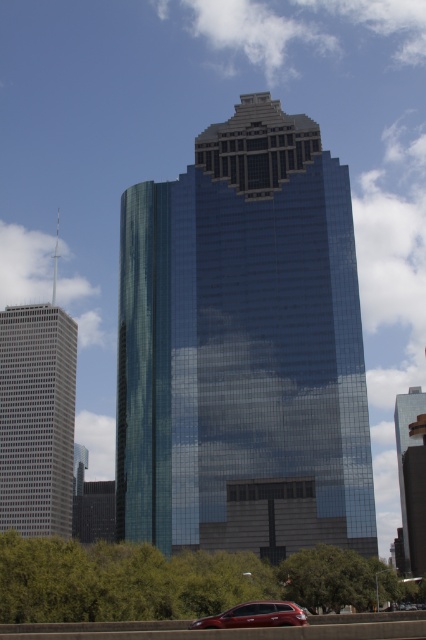
Is shiny glass skyscraper at center above shiny glass skyscraper at right?

Yes.

Which is more to the right, shiny glass skyscraper at center or shiny glass skyscraper at right?

Positioned to the right is shiny glass skyscraper at right.

What do you see at coordinates (244, 348) in the screenshot?
I see `shiny glass skyscraper at center` at bounding box center [244, 348].

You are a GUI agent. You are given a task and a screenshot of the screen. Output one action in this format:
    pyautogui.click(x=<x>, y=<y>)
    Task: Click on the shiny glass skyscraper at center
    The width and height of the screenshot is (426, 640).
    Given the screenshot: What is the action you would take?
    pyautogui.click(x=244, y=348)

Does gray glass skyscraper at left have a smaller size compared to shiny metallic car at lower center?

Incorrect, gray glass skyscraper at left is not smaller in size than shiny metallic car at lower center.

Is gray glass skyscraper at left positioned at the back of shiny metallic car at lower center?

Yes, it is behind shiny metallic car at lower center.

Measure the distance between gray glass skyscraper at left and camera.

The distance of gray glass skyscraper at left from camera is 141.73 meters.

Where is `gray glass skyscraper at left`? The height and width of the screenshot is (640, 426). gray glass skyscraper at left is located at coordinates (37, 419).

Is shiny metallic car at lower center bigger than shiny glass skyscraper at right?

No.

Does shiny metallic car at lower center have a greater height compared to shiny glass skyscraper at right?

In fact, shiny metallic car at lower center may be shorter than shiny glass skyscraper at right.

Between point (259, 621) and point (399, 404), which one is positioned in front?

Point (259, 621) is in front.

Locate an element on the screen. The width and height of the screenshot is (426, 640). shiny metallic car at lower center is located at coordinates (255, 616).